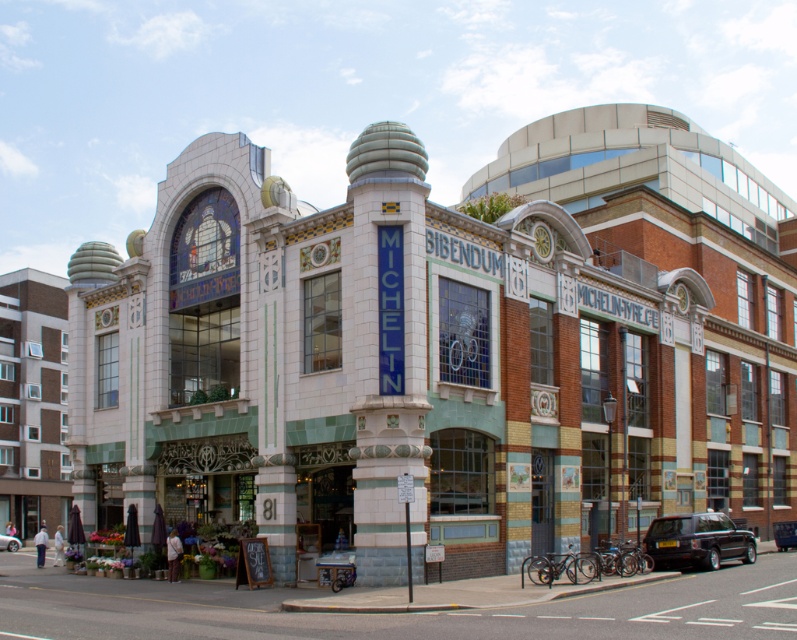
Question: Can you confirm if white tiled theater at center is positioned to the right of metallic silver car at center?

Choices:
 (A) yes
 (B) no

Answer: (A)

Question: Is shiny black suv at lower right positioned behind metallic silver car at center?

Choices:
 (A) no
 (B) yes

Answer: (A)

Question: Is white tiled theater at center thinner than metallic silver car at center?

Choices:
 (A) no
 (B) yes

Answer: (A)

Question: Which point is farther to the camera?

Choices:
 (A) (737, 538)
 (B) (6, 541)
 (C) (775, 380)

Answer: (B)

Question: Which point is closer to the camera taking this photo?

Choices:
 (A) (6, 531)
 (B) (340, 452)
 (C) (648, 532)

Answer: (B)

Question: Which point appears farthest from the camera in this image?

Choices:
 (A) (436, 424)
 (B) (16, 540)
 (C) (744, 548)

Answer: (B)